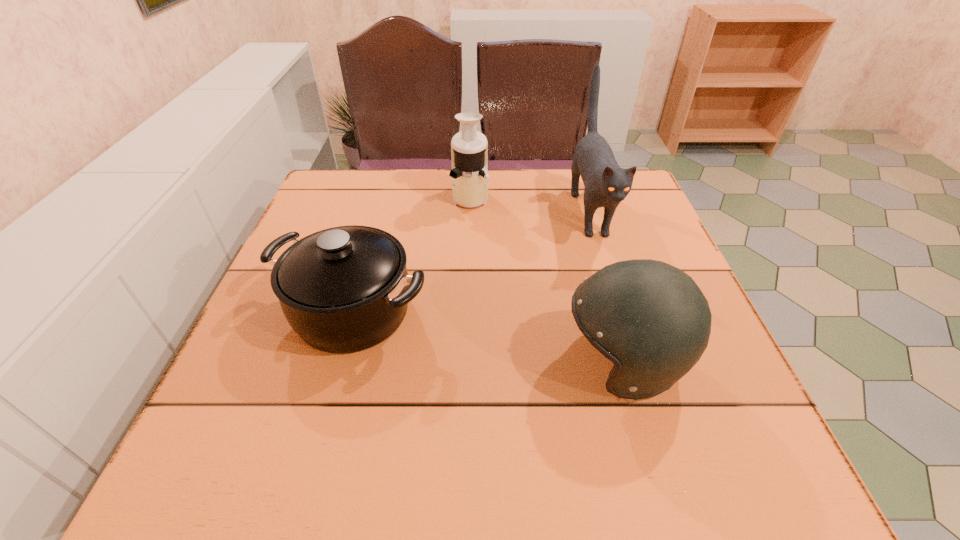
Image resolution: width=960 pixels, height=540 pixels. I want to click on free spot between the football helmet and the saucepan, so click(x=488, y=336).

This screenshot has height=540, width=960. What are the coordinates of `the second closest object to the juicer` in the screenshot? It's located at pyautogui.click(x=345, y=289).

Identify the location of object that is the closest one to the juicer. (606, 184).

Locate an element on the screen. The width and height of the screenshot is (960, 540). free space that satisfies the following two spatial constraints: 1. at the face of the tallest object; 2. at the face opening of the football helmet is located at coordinates (636, 362).

You are a GUI agent. You are given a task and a screenshot of the screen. Output one action in this format:
    pyautogui.click(x=<x>, y=<y>)
    Task: Click on the vacant space that satisfies the following two spatial constraints: 1. at the face of the tallest object; 2. at the face opening of the football helmet
    The height and width of the screenshot is (540, 960).
    Given the screenshot: What is the action you would take?
    pyautogui.click(x=636, y=362)